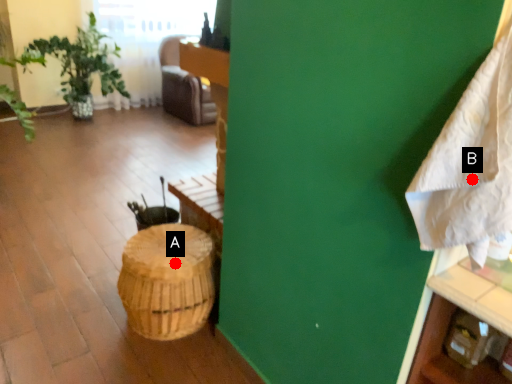
Question: Two points are circled on the image, labeled by A and B beside each circle. Among these points, which one is farthest from the camera?

Choices:
 (A) A is further
 (B) B is further

Answer: (A)